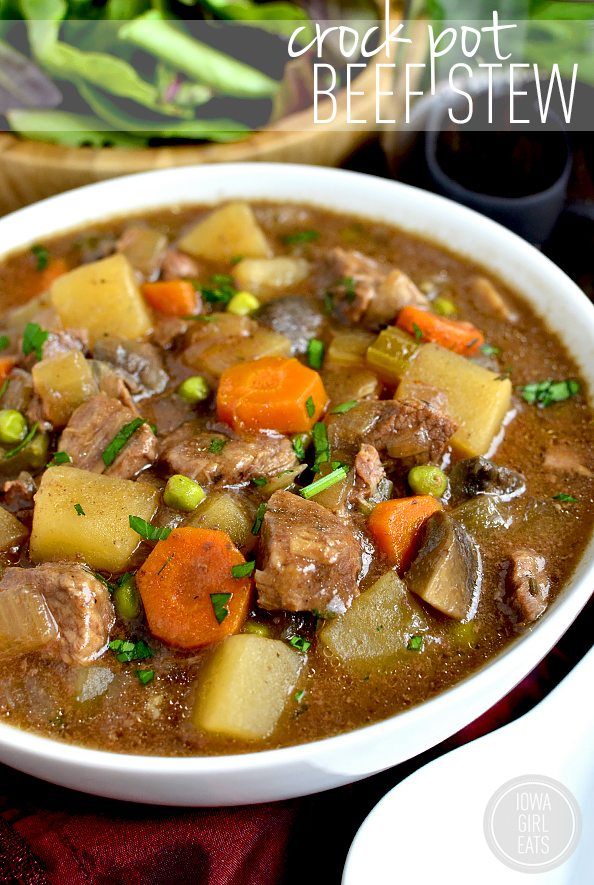
Find the location of `white bowl`. white bowl is located at coordinates (343, 749).